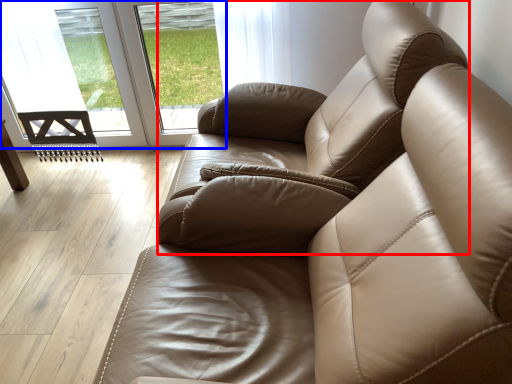
Question: Which object is closer to the camera taking this photo, armchair (highlighted by a red box) or glass door (highlighted by a blue box)?

Choices:
 (A) armchair
 (B) glass door

Answer: (A)